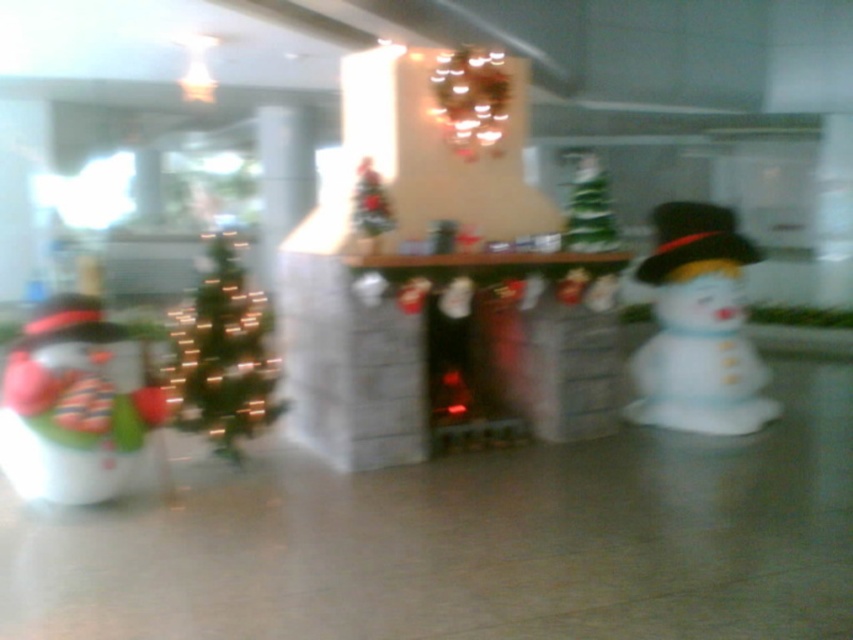
Can you confirm if green matte christmas tree at left is bigger than green matte christmas tree at center?

Correct, green matte christmas tree at left is larger in size than green matte christmas tree at center.

Does green matte christmas tree at left have a lesser height compared to green matte christmas tree at center?

Incorrect, green matte christmas tree at left's height does not fall short of green matte christmas tree at center's.

Between point (207, 355) and point (593, 248), which one is positioned in front?

Point (207, 355) is in front.

This screenshot has width=853, height=640. Find the location of `green matte christmas tree at left`. green matte christmas tree at left is located at coordinates (223, 355).

Between point (50, 422) and point (281, 410), which one is positioned in front?

Point (50, 422) is more forward.

Which is more to the left, matte white snowman at left or green matte christmas tree at left?

matte white snowman at left is more to the left.

What do you see at coordinates (77, 404) in the screenshot? The image size is (853, 640). I see `matte white snowman at left` at bounding box center [77, 404].

Locate an element on the screen. matte white snowman at left is located at coordinates (77, 404).

Is white glossy snowman at right above green matte christmas tree at center?

No.

Between point (728, 424) and point (585, 166), which one is positioned in front?

Point (585, 166) is in front.

Which is behind, point (666, 326) or point (576, 248)?

The point (666, 326) is more distant.

Where is `white glossy snowman at right`? white glossy snowman at right is located at coordinates (698, 326).